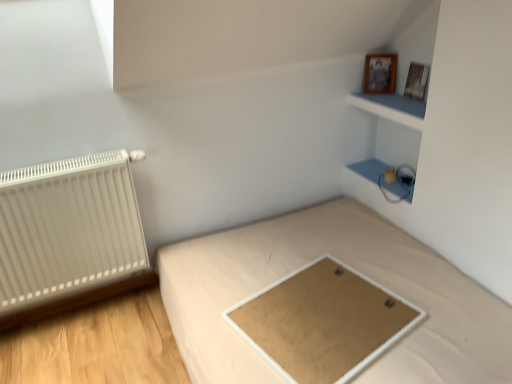
What do you see at coordinates (416, 81) in the screenshot?
I see `wooden picture frame at upper right, placed as the 2th picture frame when sorted from left to right` at bounding box center [416, 81].

The height and width of the screenshot is (384, 512). What are the coordinates of `blue matte cabinet at upper right, which is counted as the first cabinet, starting from the top` in the screenshot? It's located at (392, 108).

In order to face blue matte cabinet at upper right, which is counted as the first cabinet, starting from the top, should I rotate leftwards or rightwards?

Turn right by 18.627 degrees to look at blue matte cabinet at upper right, which is counted as the first cabinet, starting from the top.

Find the location of a particular element. The height and width of the screenshot is (384, 512). light brown fabric bed at center is located at coordinates (301, 266).

Does blue matte cabinet at upper right, which is counted as the first cabinet, starting from the top, appear on the right side of matte white cabinet at upper right, the second cabinet in the top-to-bottom sequence?

In fact, blue matte cabinet at upper right, which is counted as the first cabinet, starting from the top, is to the left of matte white cabinet at upper right, the second cabinet in the top-to-bottom sequence.

Is blue matte cabinet at upper right, which is counted as the first cabinet, starting from the top, behind matte white cabinet at upper right, the second cabinet in the top-to-bottom sequence?

No, it is in front of matte white cabinet at upper right, the second cabinet in the top-to-bottom sequence.

Consider the image. Considering the sizes of blue matte cabinet at upper right, which is counted as the 2th cabinet, starting from the bottom, and matte white cabinet at upper right, which is counted as the first cabinet, starting from the bottom, in the image, is blue matte cabinet at upper right, which is counted as the 2th cabinet, starting from the bottom, taller or shorter than matte white cabinet at upper right, which is counted as the first cabinet, starting from the bottom,?

Considering their sizes, blue matte cabinet at upper right, which is counted as the 2th cabinet, starting from the bottom, has less height than matte white cabinet at upper right, which is counted as the first cabinet, starting from the bottom.

Is blue matte cabinet at upper right, which is counted as the first cabinet, starting from the top, facing away from matte white cabinet at upper right, which is counted as the first cabinet, starting from the bottom?

That's not correct — blue matte cabinet at upper right, which is counted as the first cabinet, starting from the top, is not looking away from matte white cabinet at upper right, which is counted as the first cabinet, starting from the bottom.

Considering the sizes of wooden photo frame at upper right, marked as the 1th picture frame in a left-to-right arrangement, and white matte radiator at left in the image, is wooden photo frame at upper right, marked as the 1th picture frame in a left-to-right arrangement, bigger or smaller than white matte radiator at left?

In the image, wooden photo frame at upper right, marked as the 1th picture frame in a left-to-right arrangement, appears to be smaller than white matte radiator at left.

In the image, is wooden photo frame at upper right, marked as the 1th picture frame in a left-to-right arrangement, positioned in front of or behind white matte radiator at left?

Visually, wooden photo frame at upper right, marked as the 1th picture frame in a left-to-right arrangement, is located behind white matte radiator at left.

Which is behind, point (378, 70) or point (130, 207)?

The point (378, 70) is more distant.

Is matte brown board at center wider than wooden photo frame at upper right, marked as the 1th picture frame in a left-to-right arrangement?

Yes.

Can you confirm if matte brown board at center is bigger than wooden photo frame at upper right, marked as the 1th picture frame in a left-to-right arrangement?

Yes, matte brown board at center is bigger than wooden photo frame at upper right, marked as the 1th picture frame in a left-to-right arrangement.

From a real-world perspective, who is located higher, matte brown board at center or wooden photo frame at upper right, marked as the 1th picture frame in a left-to-right arrangement?

wooden photo frame at upper right, marked as the 1th picture frame in a left-to-right arrangement, is physically above.

Can wooden photo frame at upper right, marked as the 2th picture frame in a right-to-left arrangement, be found inside matte white cabinet at upper right, the second cabinet in the top-to-bottom sequence?

No, wooden photo frame at upper right, marked as the 2th picture frame in a right-to-left arrangement, is located outside of matte white cabinet at upper right, the second cabinet in the top-to-bottom sequence.

Is matte white cabinet at upper right, which is counted as the first cabinet, starting from the bottom, oriented towards wooden photo frame at upper right, marked as the 2th picture frame in a right-to-left arrangement?

No, matte white cabinet at upper right, which is counted as the first cabinet, starting from the bottom, is not turned towards wooden photo frame at upper right, marked as the 2th picture frame in a right-to-left arrangement.

Is matte white cabinet at upper right, which is counted as the first cabinet, starting from the bottom, bigger or smaller than wooden photo frame at upper right, marked as the 2th picture frame in a right-to-left arrangement?

In the image, matte white cabinet at upper right, which is counted as the first cabinet, starting from the bottom, appears to be larger than wooden photo frame at upper right, marked as the 2th picture frame in a right-to-left arrangement.

From the image's perspective, does wooden picture frame at upper right, which is the 1th picture frame from right to left, appear higher than light brown fabric bed at center?

Correct, wooden picture frame at upper right, which is the 1th picture frame from right to left, appears higher than light brown fabric bed at center in the image.

Does wooden picture frame at upper right, placed as the 2th picture frame when sorted from left to right, have a lesser width compared to light brown fabric bed at center?

Indeed, wooden picture frame at upper right, placed as the 2th picture frame when sorted from left to right, has a lesser width compared to light brown fabric bed at center.

Starting from the light brown fabric bed at center, which picture frame is the 1st one behind? Please provide its 2D coordinates.

[(416, 81)]

Is the position of wooden picture frame at upper right, placed as the 2th picture frame when sorted from left to right, less distant than that of light brown fabric bed at center?

No, it is not.

Is wooden picture frame at upper right, placed as the 2th picture frame when sorted from left to right, positioned beyond the bounds of wooden photo frame at upper right, marked as the 1th picture frame in a left-to-right arrangement?

wooden picture frame at upper right, placed as the 2th picture frame when sorted from left to right, is positioned outside wooden photo frame at upper right, marked as the 1th picture frame in a left-to-right arrangement.

Consider the image. Between wooden picture frame at upper right, placed as the 2th picture frame when sorted from left to right, and wooden photo frame at upper right, marked as the 1th picture frame in a left-to-right arrangement, which one appears on the left side from the viewer's perspective?

wooden photo frame at upper right, marked as the 1th picture frame in a left-to-right arrangement, is more to the left.

In the scene shown: From a real-world perspective, is wooden picture frame at upper right, placed as the 2th picture frame when sorted from left to right, positioned above or below wooden photo frame at upper right, marked as the 2th picture frame in a right-to-left arrangement?

wooden picture frame at upper right, placed as the 2th picture frame when sorted from left to right, is situated lower than wooden photo frame at upper right, marked as the 2th picture frame in a right-to-left arrangement, in the real world.

Identify the location of picture frame lying on the left of wooden picture frame at upper right, which is the 1th picture frame from right to left. click(x=380, y=73).

This screenshot has height=384, width=512. What are the coordinates of `the 1st cabinet above the light brown fabric bed at center (from the image's perspective)` in the screenshot? It's located at (369, 169).

In the image, is light brown fabric bed at center positioned in front of or behind matte white cabinet at upper right, which is counted as the first cabinet, starting from the bottom?

Visually, light brown fabric bed at center is located in front of matte white cabinet at upper right, which is counted as the first cabinet, starting from the bottom.

From the image's perspective, between light brown fabric bed at center and matte white cabinet at upper right, which is counted as the first cabinet, starting from the bottom, who is located below?

light brown fabric bed at center appears lower in the image.

Locate an element on the screen. cabinet below the blue matte cabinet at upper right, which is counted as the first cabinet, starting from the top (from the image's perspective) is located at coordinates (369, 169).

You are a GUI agent. You are given a task and a screenshot of the screen. Output one action in this format:
    pyautogui.click(x=<x>, y=<y>)
    Task: Click on the radiator that appears below the wooden photo frame at upper right, marked as the 2th picture frame in a right-to-left arrangement (from a real-world perspective)
    This screenshot has width=512, height=384.
    Given the screenshot: What is the action you would take?
    pyautogui.click(x=68, y=228)

From the image, which object appears to be nearer to matte brown board at center, matte white cabinet at upper right, which is counted as the first cabinet, starting from the bottom, or wooden photo frame at upper right, marked as the 2th picture frame in a right-to-left arrangement?

Among the two, matte white cabinet at upper right, which is counted as the first cabinet, starting from the bottom, is located nearer to matte brown board at center.

Which object lies nearer to the anchor point wooden photo frame at upper right, marked as the 2th picture frame in a right-to-left arrangement, white matte radiator at left or matte brown board at center?

Among the two, matte brown board at center is located nearer to wooden photo frame at upper right, marked as the 2th picture frame in a right-to-left arrangement.

Looking at the image, which one is located further to matte white cabinet at upper right, the second cabinet in the top-to-bottom sequence, white matte radiator at left or matte brown board at center?

white matte radiator at left lies further to matte white cabinet at upper right, the second cabinet in the top-to-bottom sequence, than the other object.

When comparing their distances from matte white cabinet at upper right, the second cabinet in the top-to-bottom sequence, does blue matte cabinet at upper right, which is counted as the 2th cabinet, starting from the bottom, or matte brown board at center seem closer?

blue matte cabinet at upper right, which is counted as the 2th cabinet, starting from the bottom.

From the image, which object appears to be nearer to blue matte cabinet at upper right, which is counted as the 2th cabinet, starting from the bottom, wooden picture frame at upper right, which is the 1th picture frame from right to left, or wooden photo frame at upper right, marked as the 2th picture frame in a right-to-left arrangement?

wooden picture frame at upper right, which is the 1th picture frame from right to left.

When comparing their distances from matte white cabinet at upper right, which is counted as the first cabinet, starting from the bottom, does white matte radiator at left or blue matte cabinet at upper right, which is counted as the 2th cabinet, starting from the bottom, seem closer?

blue matte cabinet at upper right, which is counted as the 2th cabinet, starting from the bottom.

From the image, which object appears to be farther from wooden picture frame at upper right, which is the 1th picture frame from right to left, white matte radiator at left or blue matte cabinet at upper right, which is counted as the first cabinet, starting from the top?

Among the two, white matte radiator at left is located further to wooden picture frame at upper right, which is the 1th picture frame from right to left.

Looking at the image, which one is located further to wooden picture frame at upper right, which is the 1th picture frame from right to left, matte white cabinet at upper right, the second cabinet in the top-to-bottom sequence, or light brown fabric bed at center?

light brown fabric bed at center is further to wooden picture frame at upper right, which is the 1th picture frame from right to left.

I want to click on table between wooden photo frame at upper right, marked as the 2th picture frame in a right-to-left arrangement, and light brown fabric bed at center vertically, so click(x=323, y=322).

Find the location of a particular element. table between white matte radiator at left and matte white cabinet at upper right, the second cabinet in the top-to-bottom sequence is located at coordinates (323, 322).

Find the location of a particular element. table between wooden picture frame at upper right, which is the 1th picture frame from right to left, and light brown fabric bed at center from top to bottom is located at coordinates (323, 322).

You are a GUI agent. You are given a task and a screenshot of the screen. Output one action in this format:
    pyautogui.click(x=<x>, y=<y>)
    Task: Click on the bed between white matte radiator at left and blue matte cabinet at upper right, which is counted as the 2th cabinet, starting from the bottom, in the horizontal direction
    This screenshot has height=384, width=512.
    Given the screenshot: What is the action you would take?
    pyautogui.click(x=301, y=266)